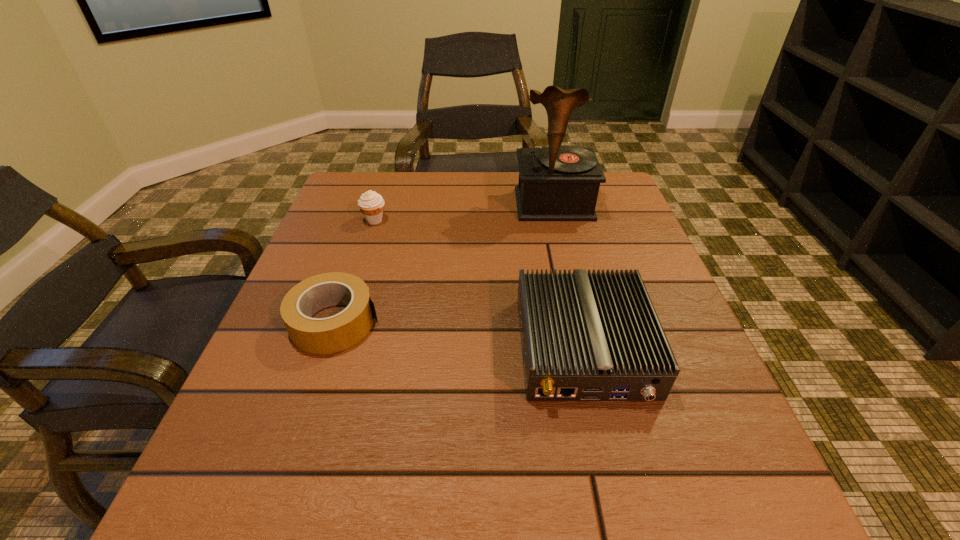
The width and height of the screenshot is (960, 540). In order to click on unoccupied area between the router and the muffin in this screenshot , I will do `click(479, 284)`.

Choose which object is the third nearest neighbor to the muffin. Please provide its 2D coordinates. Your answer should be formatted as a tuple, i.e. [(x, y)], where the tuple contains the x and y coordinates of a point satisfying the conditions above.

[(585, 337)]

Find the location of a particular element. The width and height of the screenshot is (960, 540). object that is the third closest to the router is located at coordinates (371, 204).

This screenshot has width=960, height=540. I want to click on free space that satisfies the following two spatial constraints: 1. at the horn opening of the phonograph_record; 2. at the edge of the shortest object, so click(582, 322).

Where is `free space that satisfies the following two spatial constraints: 1. at the horn opening of the phonograph_record; 2. at the edge of the shortest object`? free space that satisfies the following two spatial constraints: 1. at the horn opening of the phonograph_record; 2. at the edge of the shortest object is located at coordinates (582, 322).

The image size is (960, 540). Find the location of `vacant space that satisfies the following two spatial constraints: 1. at the horn opening of the tallest object; 2. at the edge of the shortest object`. vacant space that satisfies the following two spatial constraints: 1. at the horn opening of the tallest object; 2. at the edge of the shortest object is located at coordinates (582, 322).